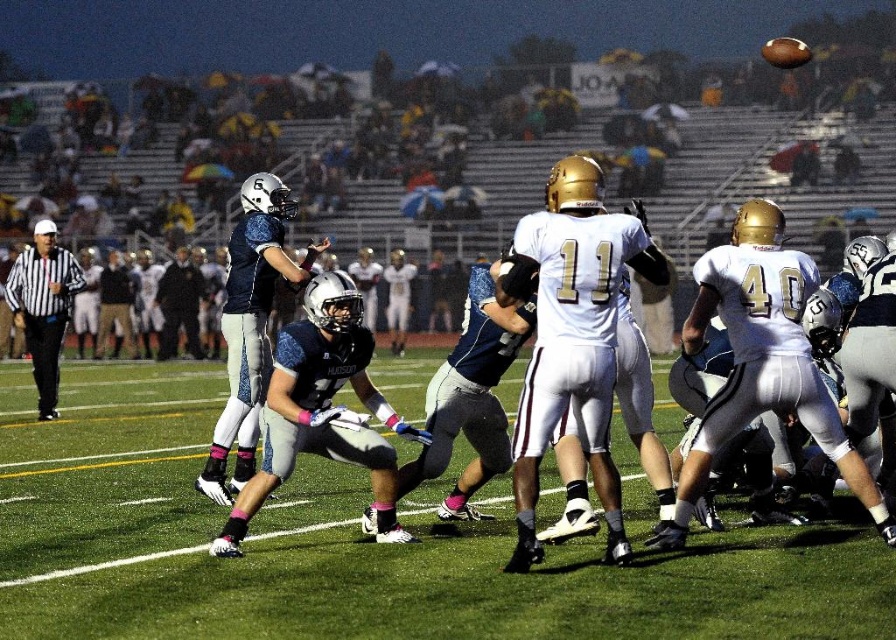
Between point (824, 560) and point (37, 250), which one is positioned behind?

Point (37, 250)

Who is positioned more to the right, green grass football field at center or black striped shirt at left?

green grass football field at center is more to the right.

Describe the element at coordinates (360, 545) in the screenshot. I see `green grass football field at center` at that location.

I want to click on green grass football field at center, so pyautogui.click(x=360, y=545).